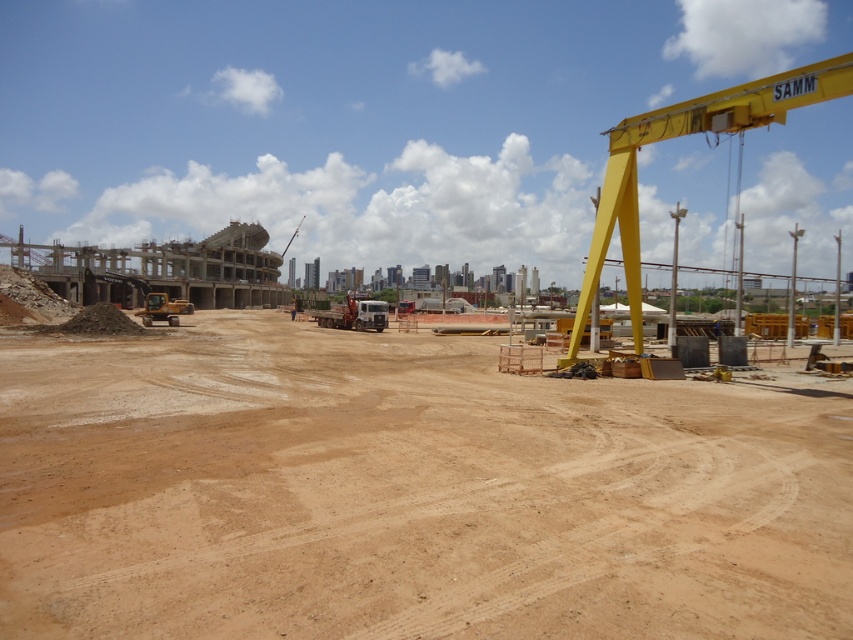
Question: Which point is farther from the camera taking this photo?

Choices:
 (A) (764, 540)
 (B) (363, 314)
 (C) (167, 298)

Answer: (C)

Question: Is yellow metallic crane at upper right positioned before metallic yellow excavator at center-left?

Choices:
 (A) no
 (B) yes

Answer: (B)

Question: Is matte white truck at center below metallic yellow excavator at center-left?

Choices:
 (A) no
 (B) yes

Answer: (A)

Question: Which point is closer to the camera?

Choices:
 (A) (602, 250)
 (B) (149, 300)
 (C) (381, 301)
 (D) (42, 564)

Answer: (D)

Question: Considering the real-world distances, which object is closest to the matte white truck at center?

Choices:
 (A) brown sandy dirt at center
 (B) yellow metallic crane at upper right
 (C) metallic yellow excavator at center-left

Answer: (C)

Question: Is yellow metallic crane at upper right further to the viewer compared to matte white truck at center?

Choices:
 (A) yes
 (B) no

Answer: (B)